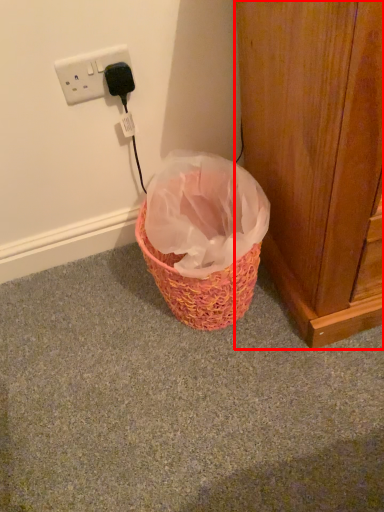
Question: From the image's perspective, where is door (annotated by the red box) located in relation to power plugs and sockets in the image?

Choices:
 (A) below
 (B) above

Answer: (A)